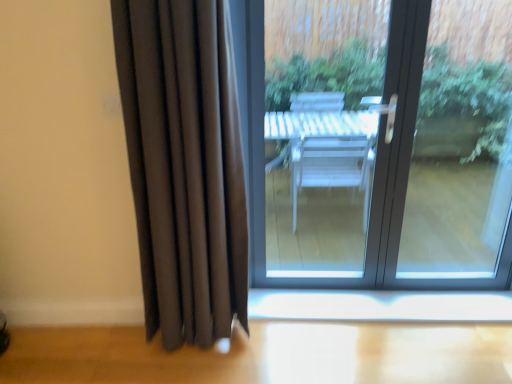
Locate an element on the screen. This screenshot has width=512, height=384. vacant region to the left of matte black curtain at left is located at coordinates (117, 350).